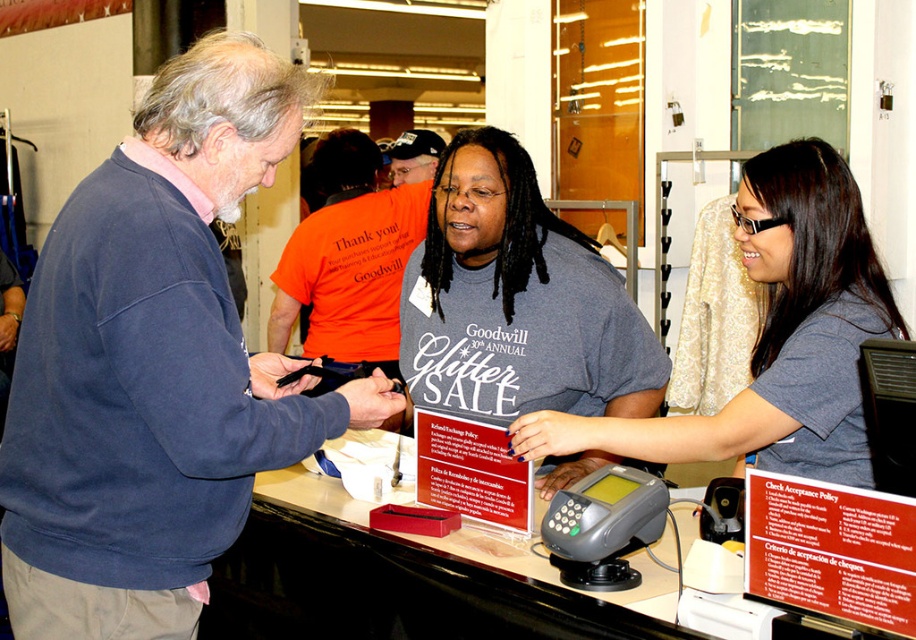
In the scene shown: Does blue sweatshirt at left have a lesser height compared to gray cotton t-shirt at center?

No, blue sweatshirt at left is not shorter than gray cotton t-shirt at center.

Does blue sweatshirt at left appear under gray cotton t-shirt at center?

Yes, blue sweatshirt at left is below gray cotton t-shirt at center.

Who is more forward, (x=235, y=348) or (x=587, y=237)?

Positioned in front is point (x=235, y=348).

Identify the location of blue sweatshirt at left. The height and width of the screenshot is (640, 916). (155, 365).

Is blue sweatshirt at left to the left of orange cotton t-shirt at center from the viewer's perspective?

Indeed, blue sweatshirt at left is positioned on the left side of orange cotton t-shirt at center.

This screenshot has width=916, height=640. What do you see at coordinates (155, 365) in the screenshot?
I see `blue sweatshirt at left` at bounding box center [155, 365].

Find the location of a particular element. blue sweatshirt at left is located at coordinates (155, 365).

What are the coordinates of `blue sweatshirt at left` in the screenshot? It's located at (155, 365).

Which is in front, point (23, 509) or point (315, 324)?

Point (23, 509)

Is point (182, 241) more distant than point (300, 278)?

No, it is not.

Image resolution: width=916 pixels, height=640 pixels. Describe the element at coordinates (155, 365) in the screenshot. I see `blue sweatshirt at left` at that location.

The width and height of the screenshot is (916, 640). What are the coordinates of `blue sweatshirt at left` in the screenshot? It's located at (155, 365).